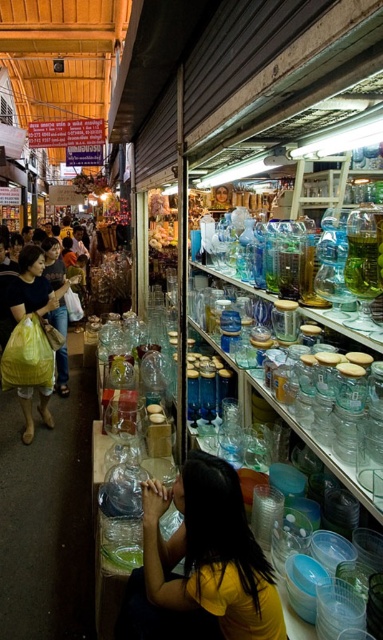
Question: Can you confirm if yellow matte shirt at center is thinner than yellow plastic bag at left?

Choices:
 (A) no
 (B) yes

Answer: (A)

Question: Among these points, which one is farthest from the camera?

Choices:
 (A) (245, 596)
 (B) (29, 360)

Answer: (B)

Question: Is yellow matte shirt at center bigger than yellow plastic bag at left?

Choices:
 (A) yes
 (B) no

Answer: (B)

Question: Observing the image, what is the correct spatial positioning of yellow matte shirt at center in reference to yellow plastic bag at left?

Choices:
 (A) below
 (B) above

Answer: (A)

Question: Among these objects, which one is nearest to the camera?

Choices:
 (A) yellow matte shirt at center
 (B) yellow plastic bag at left

Answer: (A)